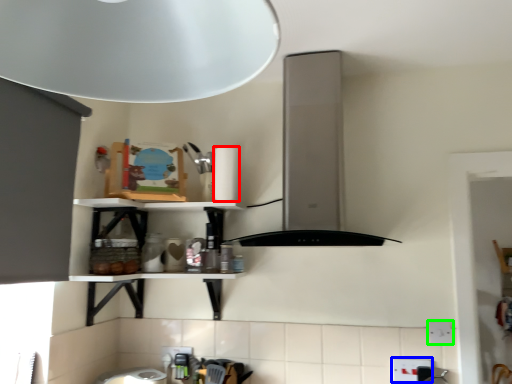
Question: Estimate the real-world distances between objects in this image. Which object is farther from paper towel (highlighted by a red box), electric outlet (highlighted by a blue box) or electric outlet (highlighted by a green box)?

Choices:
 (A) electric outlet
 (B) electric outlet

Answer: (B)